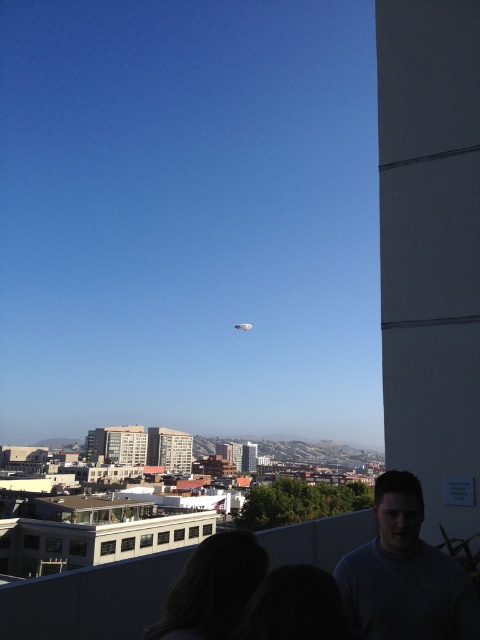
Which is below, dark gray sweater at lower right or dark hair at lower left?

dark hair at lower left

Which is behind, point (434, 550) or point (204, 552)?

Point (434, 550)

Locate an element on the screen. Image resolution: width=480 pixels, height=640 pixels. dark gray sweater at lower right is located at coordinates (405, 573).